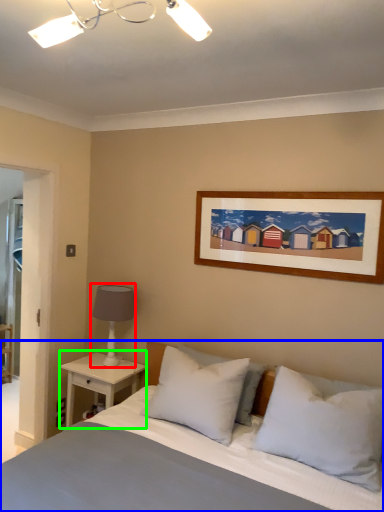
Question: Which is nearer to the table lamp (highlighted by a red box)? bed (highlighted by a blue box) or nightstand (highlighted by a green box).

Choices:
 (A) bed
 (B) nightstand

Answer: (B)